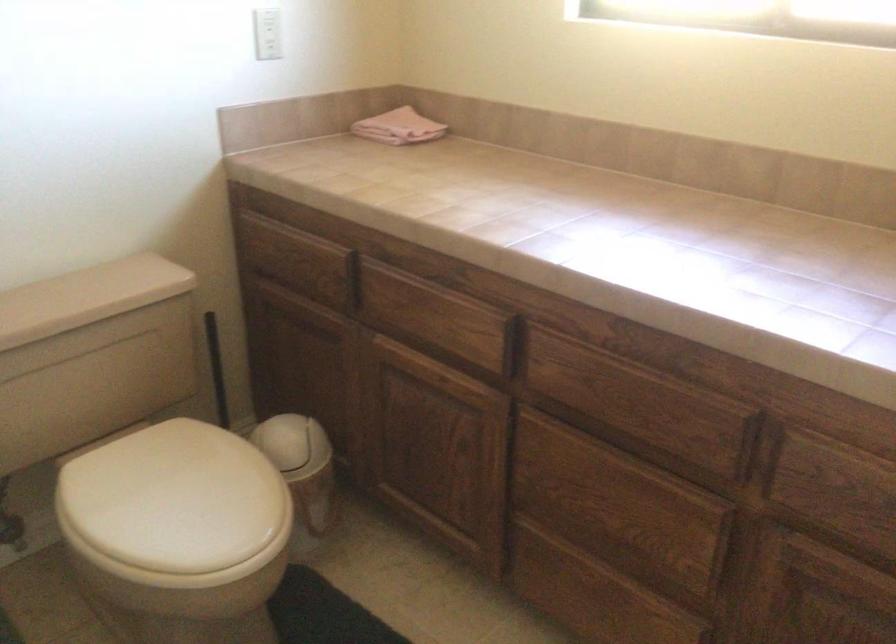
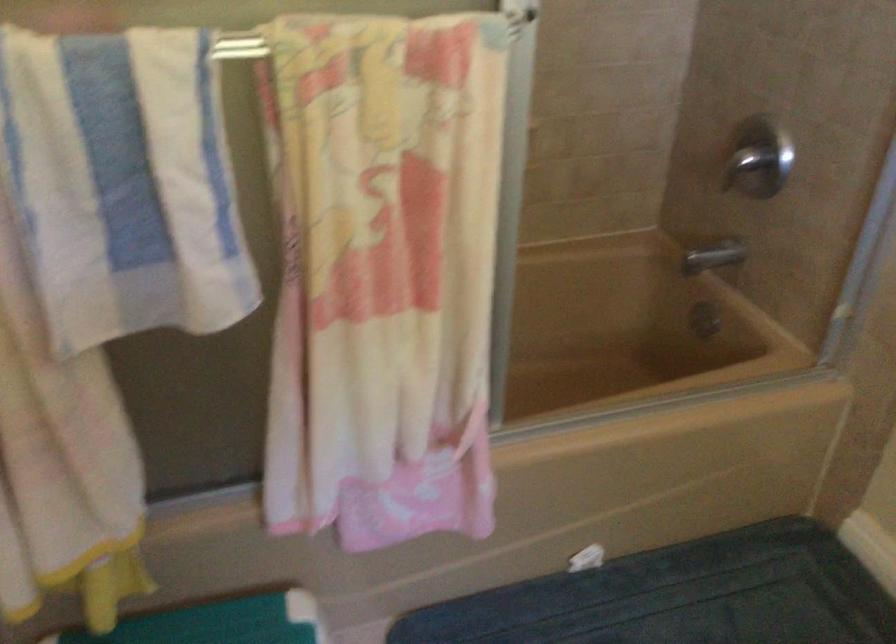
How did the camera likely rotate?

The rotation direction of the camera is left-down.